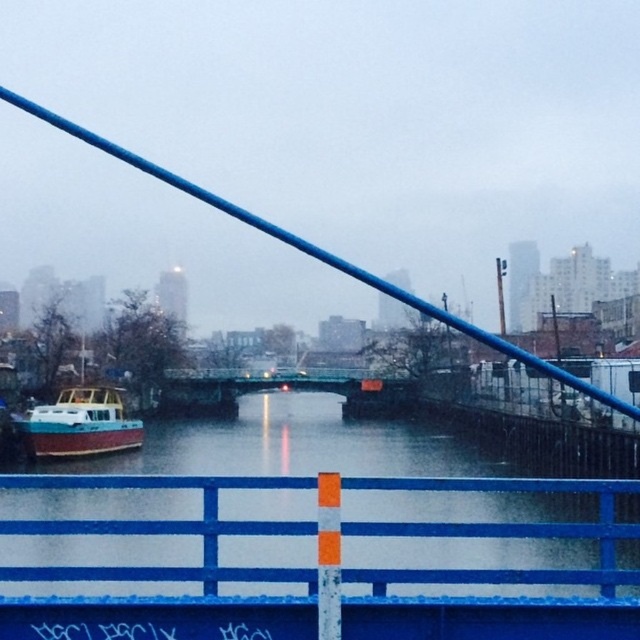
You are standing on the bridge and want to take a photo of the smooth wooden boat at left and the blue painted metal rail at center. Which object will appear larger in your photo?

The smooth wooden boat at left will appear larger in the photo because it is closer to the viewer than the blue painted metal rail at center.

You are a painter who wants to paint the blue painted metal rail at center and the teal wooden boat at left in the scene. Which object is wider?

The blue painted metal rail at center is wider than the teal wooden boat at left.

You are a photographer planning to capture both the smooth wooden boat at left and the teal wooden boat at left in a single frame. Given their sizes, which boat should you position closer to the camera to ensure both are visible without cropping?

Since the smooth wooden boat at left is wider than the teal wooden boat at left, you should position the smooth wooden boat at left closer to the camera to maintain visibility of both boats in the frame.